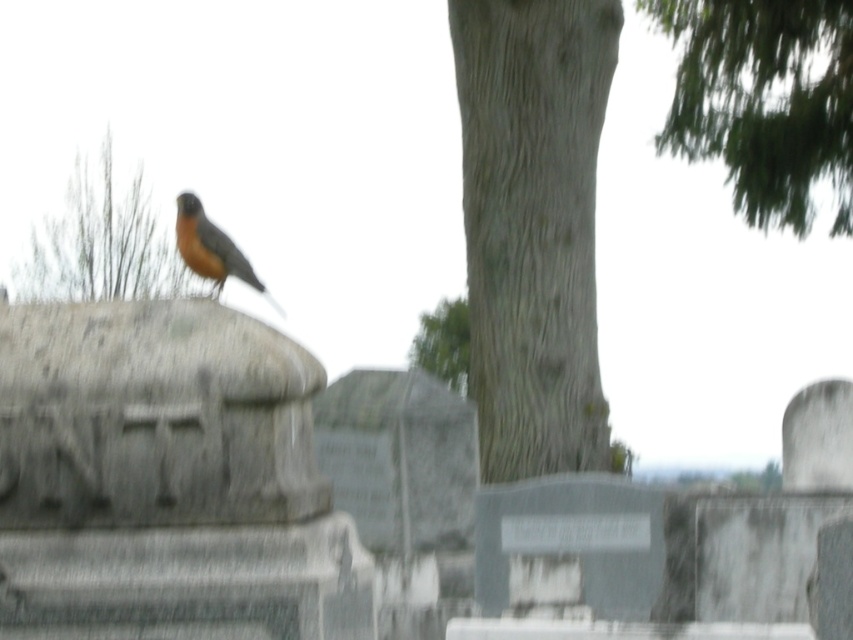
Question: Is green leafy tree at upper right wider than brown textured tree trunk at upper center?

Choices:
 (A) no
 (B) yes

Answer: (A)

Question: Which of the following is the farthest from the observer?

Choices:
 (A) brown textured tree trunk at upper center
 (B) gray textured tree trunk at center

Answer: (B)

Question: Can you confirm if gray textured tree trunk at center is bigger than brown matte bird at center?

Choices:
 (A) no
 (B) yes

Answer: (B)

Question: Is green leafy tree at upper right smaller than brown matte bird at center?

Choices:
 (A) no
 (B) yes

Answer: (A)

Question: Based on their relative distances, which object is nearer to the brown matte bird at center?

Choices:
 (A) green leafy tree at upper right
 (B) gray textured tree trunk at center
 (C) brown textured tree trunk at upper center

Answer: (B)

Question: Among these objects, which one is farthest from the camera?

Choices:
 (A) gray textured tree trunk at center
 (B) green textured tree at center

Answer: (B)